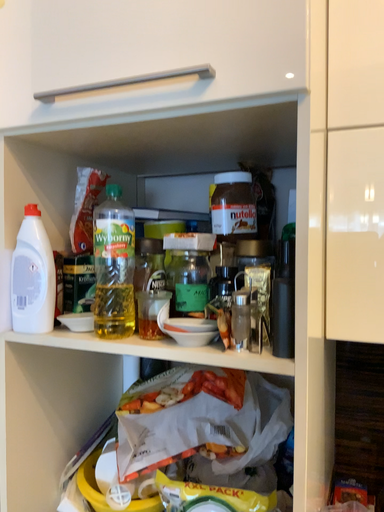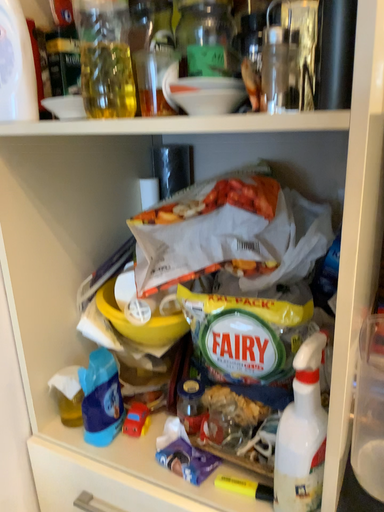
Question: How did the camera likely rotate when shooting the video?

Choices:
 (A) rotated upward
 (B) rotated downward

Answer: (B)